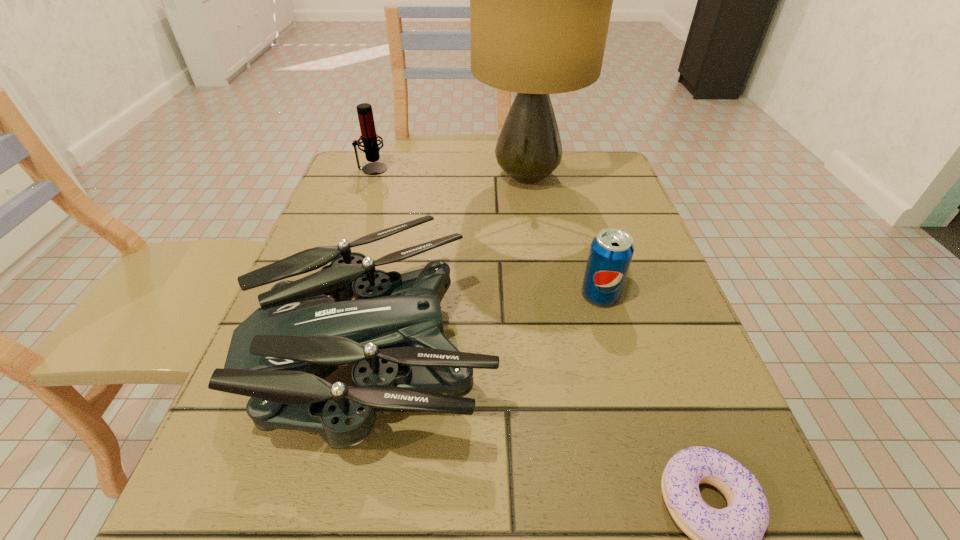
What are the coordinates of `the closest object relative to the second tallest object` in the screenshot? It's located at (540, 0).

The width and height of the screenshot is (960, 540). Find the location of `vacant position in the image that satisfies the following two spatial constraints: 1. on the back side of the lampshade; 2. on the right side of the drone`. vacant position in the image that satisfies the following two spatial constraints: 1. on the back side of the lampshade; 2. on the right side of the drone is located at coordinates (413, 177).

At what (x,y) coordinates should I click in order to perform the action: click on free region that satisfies the following two spatial constraints: 1. on the back side of the pop soda; 2. on the left side of the drone. Please return your answer as a coordinate pair (x, y). This screenshot has width=960, height=540. Looking at the image, I should click on (388, 295).